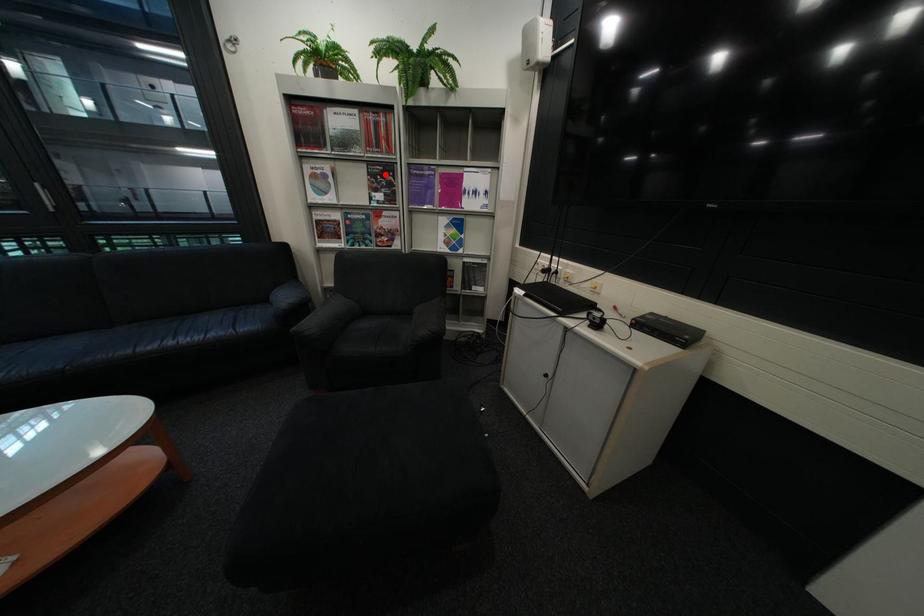
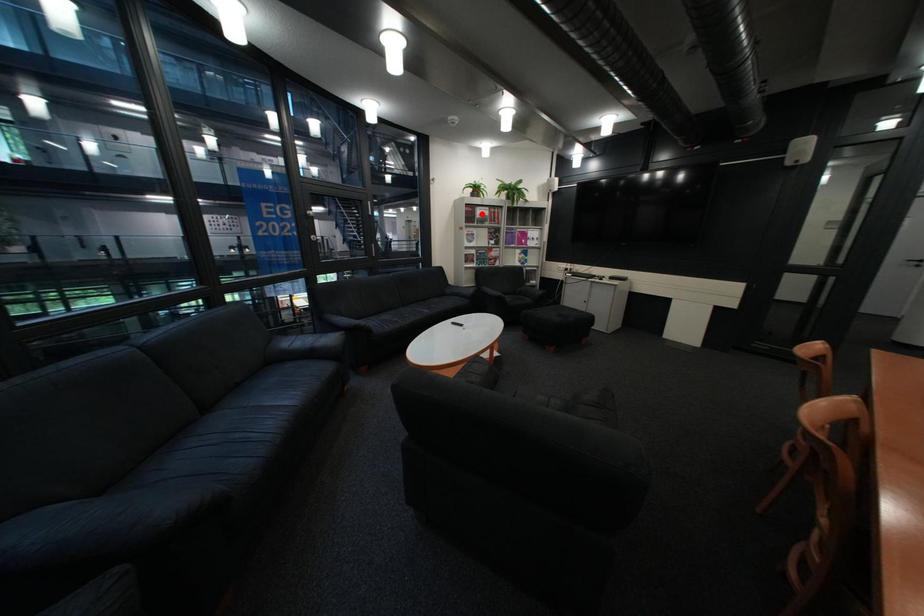
I am providing you with two images of the same scene from different viewpoints. A red point is marked on the first image and another point is marked on the second image. Is the marked point in image1 the same physical position as the marked point in image2?

No